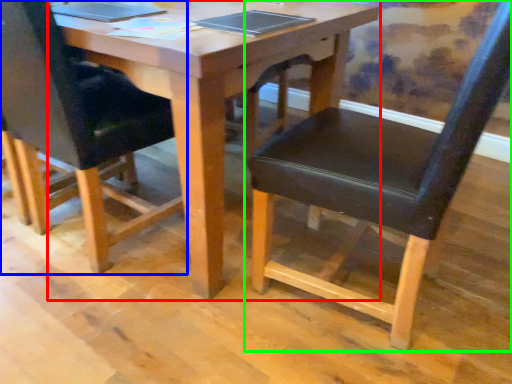
Question: Considering the real-world distances, which object is farthest from table (highlighted by a red box)? chair (highlighted by a blue box) or chair (highlighted by a green box)?

Choices:
 (A) chair
 (B) chair

Answer: (A)